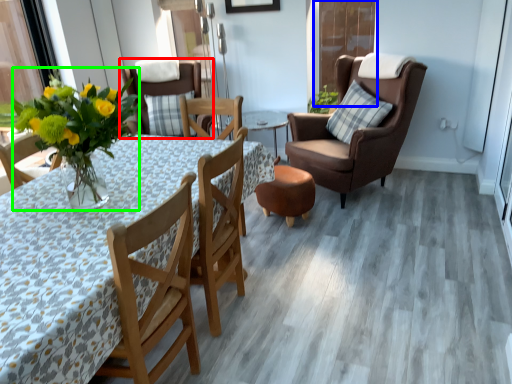
Question: Estimate the real-world distances between objects in this image. Which object is closer to chair (highlighted by a red box), screen door (highlighted by a blue box) or floral arrangement (highlighted by a green box)?

Choices:
 (A) screen door
 (B) floral arrangement

Answer: (A)